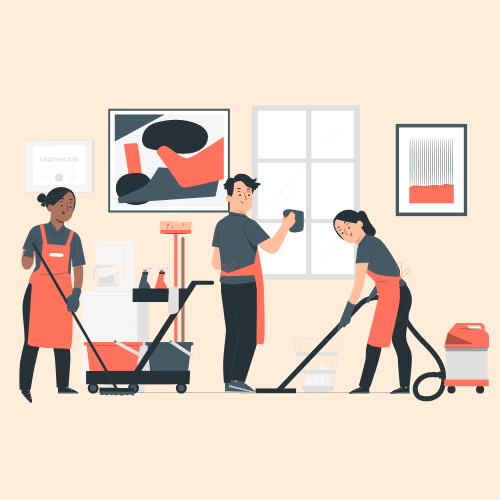
Locate an element on the screen. Image resolution: width=500 pixels, height=500 pixels. cleaning cart is located at coordinates (172, 377).